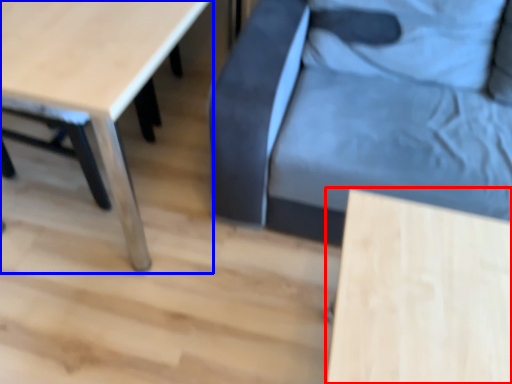
Question: Among these objects, which one is farthest to the camera, table (highlighted by a red box) or table (highlighted by a blue box)?

Choices:
 (A) table
 (B) table

Answer: (B)